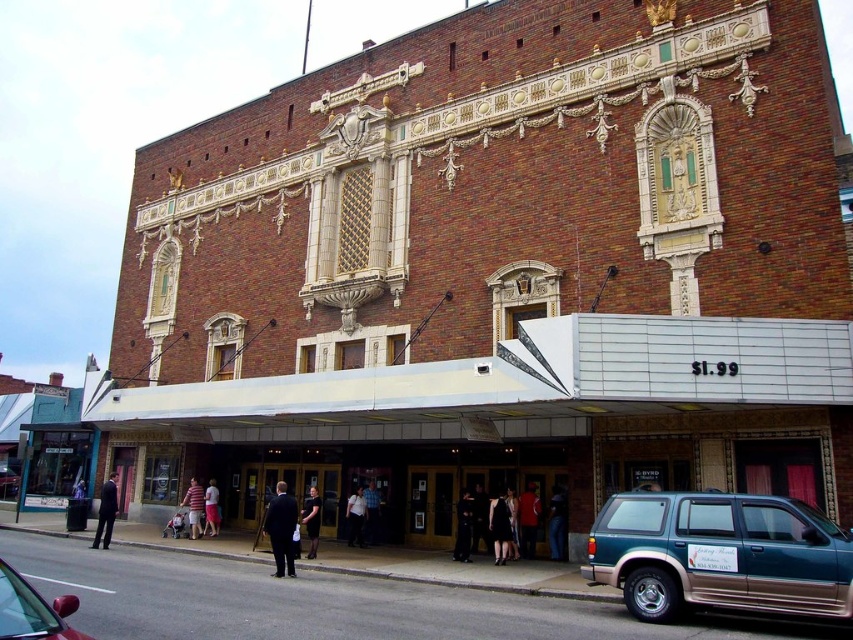
Question: Which object appears closest to the camera in this image?

Choices:
 (A) matte black dress at center
 (B) teal matte suv at lower right

Answer: (B)

Question: Among these points, which one is nearest to the camera?

Choices:
 (A) (210, 477)
 (B) (195, 499)
 (C) (280, 560)
 (D) (753, 538)

Answer: (D)

Question: Is matte black dress at center further to the viewer compared to light pink fabric dress at center?

Choices:
 (A) no
 (B) yes

Answer: (A)

Question: Can you confirm if shiny red car at lower left is wider than dark suit at center?

Choices:
 (A) no
 (B) yes

Answer: (B)

Question: Which object appears closest to the camera in this image?

Choices:
 (A) dark blue suit at center
 (B) matte black dress at center
 (C) shiny red car at lower left
 (D) striped shirt at center

Answer: (C)

Question: Is teal matte suv at lower right positioned before black dress at center?

Choices:
 (A) yes
 (B) no

Answer: (A)